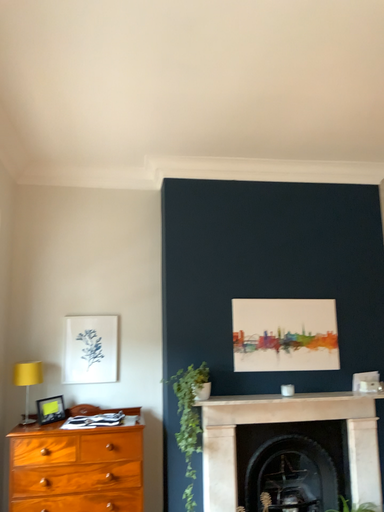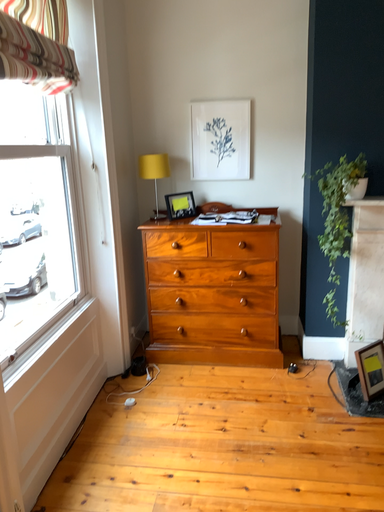
Question: Which way did the camera rotate in the video?

Choices:
 (A) rotated left
 (B) rotated right

Answer: (A)